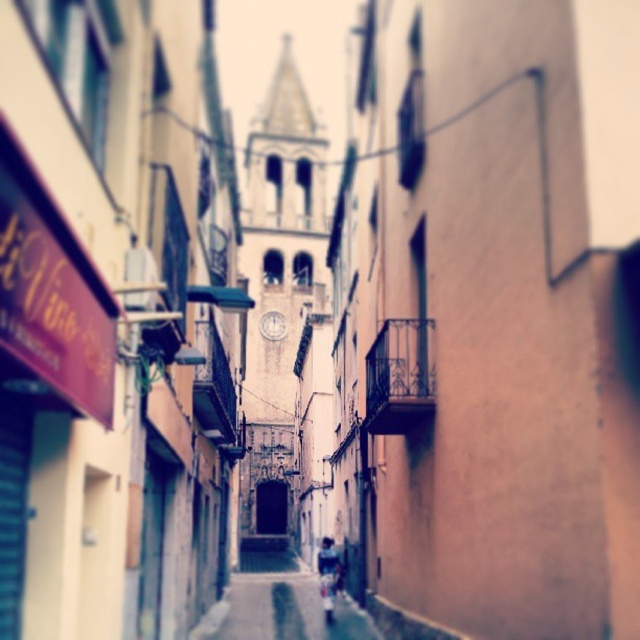
You are a delivery person carrying a package and need to navigate through the narrow street. You see the smooth concrete alley at center and the dark blue denim jacket at center. Which object is taller, and does this affect your ability to pass through?

The smooth concrete alley at center is much taller than the dark blue denim jacket at center. This means the alley is tall enough for you to pass through without any issues.

You are standing in the middle of the street and see the smooth concrete alley at center and the dark blue denim jacket at center. Which object is nearer to you?

The smooth concrete alley at center is closer to the viewer than the dark blue denim jacket at center.

You are standing at the entrance of the smooth concrete alley at center. You want to walk straight ahead. Based on the image, what is the direction you should face to walk straight along the alley?

The smooth concrete alley at center is positioned at point coordinates of (280, 604). To walk straight along the alley, you should face the direction that aligns with the alleyway extending from this central point.